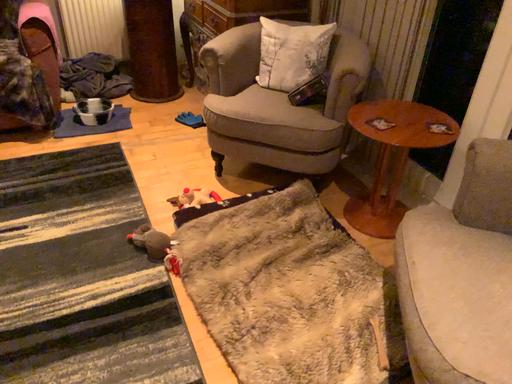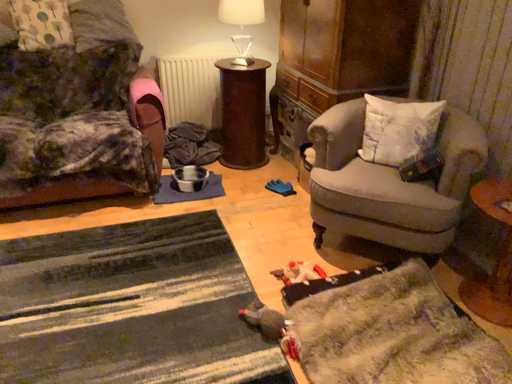
Question: Which way did the camera rotate in the video?

Choices:
 (A) rotated downward
 (B) rotated upward

Answer: (B)